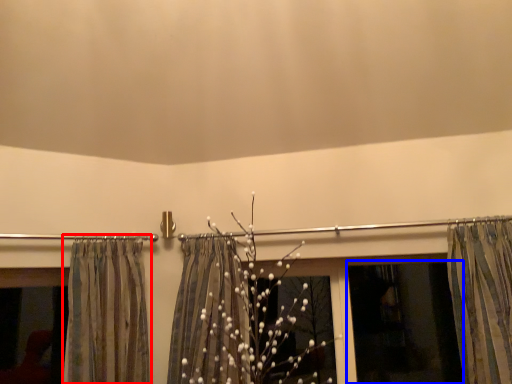
Question: Which of the following is the farthest to the observer, curtain (highlighted by a red box) or window screen (highlighted by a blue box)?

Choices:
 (A) curtain
 (B) window screen

Answer: (B)